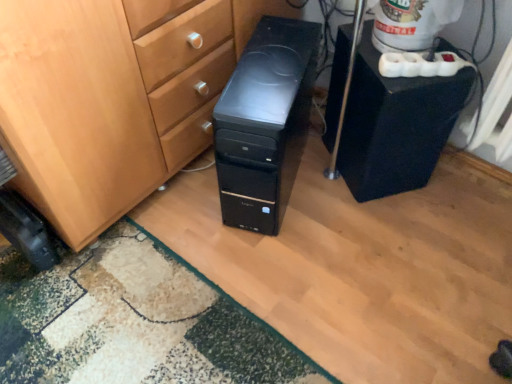
At what (x,y) coordinates should I click in order to perform the action: click on space that is in front of black plastic speaker at right. Please return your answer as a coordinate pair (x, y). The image size is (512, 384). Looking at the image, I should click on (387, 233).